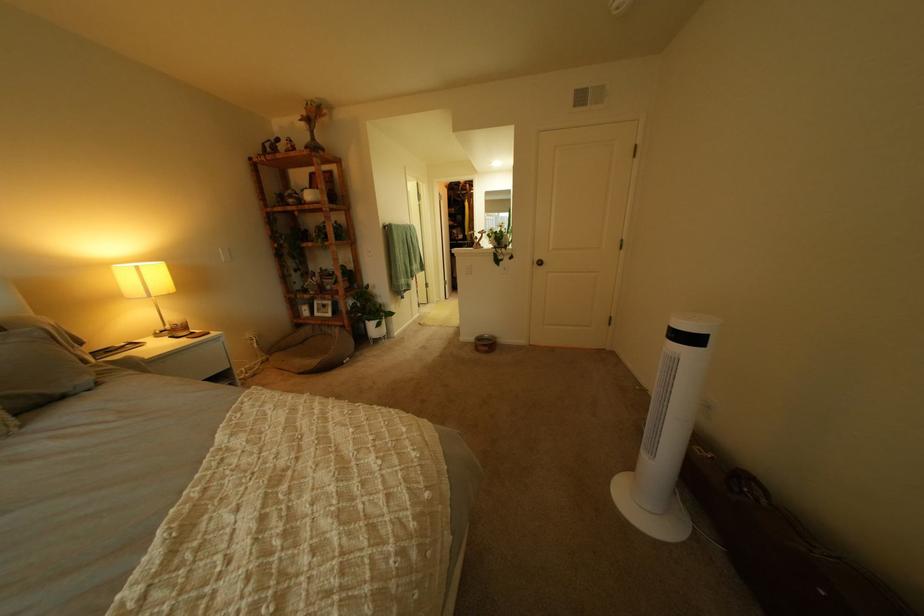
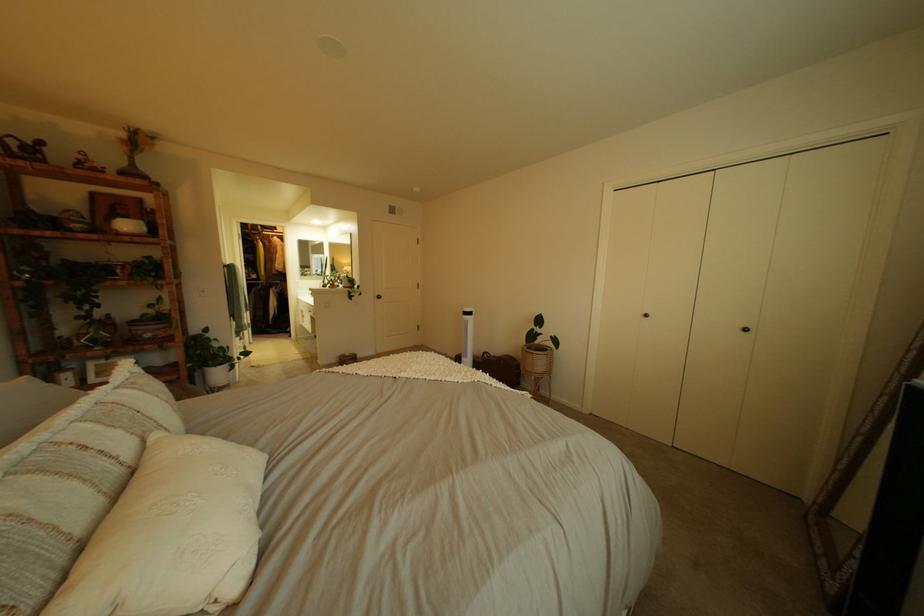
The point at (342, 272) is marked in the first image. Where is the corresponding point in the second image?

(161, 315)